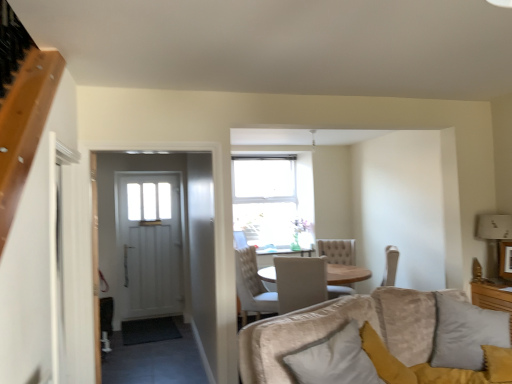
Question: Is white soft pillow at lower right, marked as the 1th pillow in a left-to-right arrangement, touching velvet gray pillow at lower right, which ranks as the first pillow in right-to-left order?

Choices:
 (A) no
 (B) yes

Answer: (A)

Question: Can you confirm if white soft pillow at lower right, marked as the 1th pillow in a left-to-right arrangement, is thinner than velvet gray pillow at lower right, which ranks as the 2th pillow in left-to-right order?

Choices:
 (A) no
 (B) yes

Answer: (B)

Question: Is white soft pillow at lower right, the second pillow positioned from the right, not inside velvet gray pillow at lower right, which ranks as the 2th pillow in left-to-right order?

Choices:
 (A) no
 (B) yes

Answer: (B)

Question: Does white soft pillow at lower right, the second pillow positioned from the right, appear on the right side of velvet gray pillow at lower right, which ranks as the 2th pillow in left-to-right order?

Choices:
 (A) no
 (B) yes

Answer: (A)

Question: Can you confirm if white soft pillow at lower right, marked as the 1th pillow in a left-to-right arrangement, is bigger than velvet gray pillow at lower right, which ranks as the first pillow in right-to-left order?

Choices:
 (A) yes
 (B) no

Answer: (B)

Question: Choose the correct answer: Is white soft pillow at lower right, marked as the 1th pillow in a left-to-right arrangement, inside white fabric lampshade at upper right or outside it?

Choices:
 (A) inside
 (B) outside

Answer: (B)

Question: From the image's perspective, is white soft pillow at lower right, marked as the 1th pillow in a left-to-right arrangement, located above or below white fabric lampshade at upper right?

Choices:
 (A) above
 (B) below

Answer: (B)

Question: In terms of size, does white soft pillow at lower right, marked as the 1th pillow in a left-to-right arrangement, appear bigger or smaller than white fabric lampshade at upper right?

Choices:
 (A) small
 (B) big

Answer: (B)

Question: From a real-world perspective, relative to white fabric lampshade at upper right, is white soft pillow at lower right, the second pillow positioned from the right, vertically above or below?

Choices:
 (A) above
 (B) below

Answer: (B)

Question: Does point (309, 365) appear closer or farther from the camera than point (258, 291)?

Choices:
 (A) closer
 (B) farther

Answer: (A)

Question: From their relative heights in the image, would you say white soft pillow at lower right, marked as the 1th pillow in a left-to-right arrangement, is taller or shorter than beige fabric chair at center?

Choices:
 (A) tall
 (B) short

Answer: (B)

Question: Do you think white soft pillow at lower right, marked as the 1th pillow in a left-to-right arrangement, is within beige fabric chair at center, or outside of it?

Choices:
 (A) outside
 (B) inside

Answer: (A)

Question: Looking at the image, does white soft pillow at lower right, marked as the 1th pillow in a left-to-right arrangement, seem bigger or smaller compared to beige fabric chair at center?

Choices:
 (A) big
 (B) small

Answer: (B)

Question: Does point (440, 365) appear closer or farther from the camera than point (498, 233)?

Choices:
 (A) closer
 (B) farther

Answer: (A)

Question: From the image's perspective, is velvet gray pillow at lower right, which ranks as the 2th pillow in left-to-right order, above or below white fabric lampshade at upper right?

Choices:
 (A) below
 (B) above

Answer: (A)